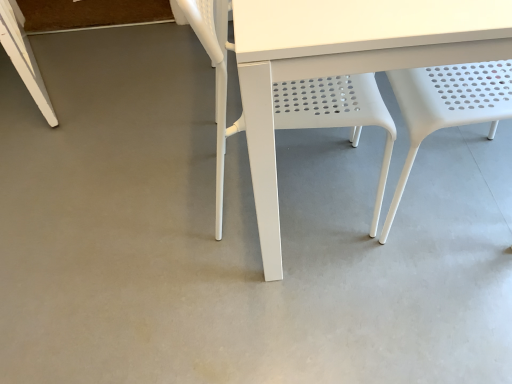
This screenshot has height=384, width=512. Find the location of `white perforated plastic chair at center, which is the first chair in right-to-left order`. white perforated plastic chair at center, which is the first chair in right-to-left order is located at coordinates (448, 105).

Describe the element at coordinates (448, 105) in the screenshot. This screenshot has width=512, height=384. I see `white perforated plastic chair at center, which is the first chair in right-to-left order` at that location.

Find the location of a particular element. white plastic chair at center, which appears as the 2th chair when viewed from the right is located at coordinates (336, 113).

What do you see at coordinates (336, 113) in the screenshot? This screenshot has width=512, height=384. I see `white plastic chair at center, placed as the first chair when sorted from left to right` at bounding box center [336, 113].

What is the approximate width of white plastic chair at center, which appears as the 2th chair when viewed from the right?

The width of white plastic chair at center, which appears as the 2th chair when viewed from the right, is 19.72 inches.

Locate an element on the screen. white perforated plastic chair at center, which is the first chair in right-to-left order is located at coordinates (448, 105).

Considering the positions of objects white perforated plastic chair at center, which is the first chair in right-to-left order, and white plastic chair at center, placed as the first chair when sorted from left to right, in the image provided, who is more to the right, white perforated plastic chair at center, which is the first chair in right-to-left order, or white plastic chair at center, placed as the first chair when sorted from left to right,?

white perforated plastic chair at center, which is the first chair in right-to-left order, is more to the right.

Which object is closer to the camera, white perforated plastic chair at center, the second chair from the left, or white plastic chair at center, which appears as the 2th chair when viewed from the right?

white perforated plastic chair at center, the second chair from the left, is in front.

Which point is more distant from viewer, (435, 125) or (223, 103)?

The point (435, 125) is more distant.

From the image's perspective, which object appears higher, white perforated plastic chair at center, which is the first chair in right-to-left order, or white plastic chair at center, which appears as the 2th chair when viewed from the right?

From the image's view, white perforated plastic chair at center, which is the first chair in right-to-left order, is above.

From a real-world perspective, who is located higher, white perforated plastic chair at center, which is the first chair in right-to-left order, or white plastic chair at center, which appears as the 2th chair when viewed from the right?

white plastic chair at center, which appears as the 2th chair when viewed from the right, is physically above.

Which object is wider, white perforated plastic chair at center, which is the first chair in right-to-left order, or white plastic chair at center, which appears as the 2th chair when viewed from the right?

white plastic chair at center, which appears as the 2th chair when viewed from the right, is wider.

Is white perforated plastic chair at center, the second chair from the left, shorter than white plastic chair at center, which appears as the 2th chair when viewed from the right?

Yes, white perforated plastic chair at center, the second chair from the left, is shorter than white plastic chair at center, which appears as the 2th chair when viewed from the right.

Does white perforated plastic chair at center, the second chair from the left, have a larger size compared to white plastic chair at center, placed as the first chair when sorted from left to right?

No, white perforated plastic chair at center, the second chair from the left, is not bigger than white plastic chair at center, placed as the first chair when sorted from left to right.

Is white perforated plastic chair at center, the second chair from the left, spatially inside white plastic chair at center, placed as the first chair when sorted from left to right, or outside of it?

white perforated plastic chair at center, the second chair from the left, exists outside the volume of white plastic chair at center, placed as the first chair when sorted from left to right.

Would you say white perforated plastic chair at center, which is the first chair in right-to-left order, is a long distance from white plastic chair at center, placed as the first chair when sorted from left to right?

white perforated plastic chair at center, which is the first chair in right-to-left order, is actually quite close to white plastic chair at center, placed as the first chair when sorted from left to right.

Is white perforated plastic chair at center, the second chair from the left, oriented towards white plastic chair at center, which appears as the 2th chair when viewed from the right?

Yes, white perforated plastic chair at center, the second chair from the left, faces towards white plastic chair at center, which appears as the 2th chair when viewed from the right.

What's the angular difference between white perforated plastic chair at center, which is the first chair in right-to-left order, and white plastic chair at center, placed as the first chair when sorted from left to right,'s facing directions?

There is a 180-degree angle between the facing directions of white perforated plastic chair at center, which is the first chair in right-to-left order, and white plastic chair at center, placed as the first chair when sorted from left to right.

Measure the distance from white perforated plastic chair at center, the second chair from the left, to white plastic chair at center, which appears as the 2th chair when viewed from the right.

The distance of white perforated plastic chair at center, the second chair from the left, from white plastic chair at center, which appears as the 2th chair when viewed from the right, is 7.98 inches.

You are a GUI agent. You are given a task and a screenshot of the screen. Output one action in this format:
    pyautogui.click(x=<x>, y=<y>)
    Task: Click on the chair below the white perforated plastic chair at center, which is the first chair in right-to-left order (from the image's perspective)
    This screenshot has height=384, width=512.
    Given the screenshot: What is the action you would take?
    pyautogui.click(x=336, y=113)

Consider the image. Which object is positioned more to the left, white plastic chair at center, which appears as the 2th chair when viewed from the right, or white perforated plastic chair at center, the second chair from the left?

Positioned to the left is white plastic chair at center, which appears as the 2th chair when viewed from the right.

Between white plastic chair at center, which appears as the 2th chair when viewed from the right, and white perforated plastic chair at center, which is the first chair in right-to-left order, which one is positioned in front?

white perforated plastic chair at center, which is the first chair in right-to-left order, is closer to the camera.

Is point (223, 80) in front of point (440, 102)?

Yes.

From the image's perspective, relative to white perforated plastic chair at center, the second chair from the left, is white plastic chair at center, placed as the first chair when sorted from left to right, above or below?

Based on their image positions, white plastic chair at center, placed as the first chair when sorted from left to right, is located beneath white perforated plastic chair at center, the second chair from the left.

From a real-world perspective, does white plastic chair at center, placed as the first chair when sorted from left to right, sit lower than white perforated plastic chair at center, the second chair from the left?

No, from a real-world perspective, white plastic chair at center, placed as the first chair when sorted from left to right, is not under white perforated plastic chair at center, the second chair from the left.

Which object is wider, white plastic chair at center, which appears as the 2th chair when viewed from the right, or white perforated plastic chair at center, which is the first chair in right-to-left order?

white plastic chair at center, which appears as the 2th chair when viewed from the right, is wider.

Does white plastic chair at center, placed as the first chair when sorted from left to right, have a lesser height compared to white perforated plastic chair at center, which is the first chair in right-to-left order?

No, white plastic chair at center, placed as the first chair when sorted from left to right, is not shorter than white perforated plastic chair at center, which is the first chair in right-to-left order.

Can you confirm if white plastic chair at center, placed as the first chair when sorted from left to right, is smaller than white perforated plastic chair at center, which is the first chair in right-to-left order?

No, white plastic chair at center, placed as the first chair when sorted from left to right, is not smaller than white perforated plastic chair at center, which is the first chair in right-to-left order.

Would you say white plastic chair at center, placed as the first chair when sorted from left to right, contains white perforated plastic chair at center, the second chair from the left?

No, white perforated plastic chair at center, the second chair from the left, is not a part of white plastic chair at center, placed as the first chair when sorted from left to right.

Is white plastic chair at center, placed as the first chair when sorted from left to right, positioned far away from white perforated plastic chair at center, the second chair from the left?

They are positioned close to each other.

Is white plastic chair at center, placed as the first chair when sorted from left to right, aimed at white perforated plastic chair at center, which is the first chair in right-to-left order?

Yes, white plastic chair at center, placed as the first chair when sorted from left to right, is aimed at white perforated plastic chair at center, which is the first chair in right-to-left order.

How far apart are white plastic chair at center, placed as the first chair when sorted from left to right, and white perforated plastic chair at center, the second chair from the left?

white plastic chair at center, placed as the first chair when sorted from left to right, and white perforated plastic chair at center, the second chair from the left, are 20.27 centimeters apart from each other.

At what (x,y) coordinates should I click in order to perform the action: click on chair below the white plastic chair at center, which appears as the 2th chair when viewed from the right (from a real-world perspective). Please return your answer as a coordinate pair (x, y). The width and height of the screenshot is (512, 384). Looking at the image, I should click on (448, 105).

Where is `chair to the right of white plastic chair at center, which appears as the 2th chair when viewed from the right`? chair to the right of white plastic chair at center, which appears as the 2th chair when viewed from the right is located at coordinates (448, 105).

Find the location of a particular element. chair above the white perforated plastic chair at center, the second chair from the left (from a real-world perspective) is located at coordinates (336, 113).